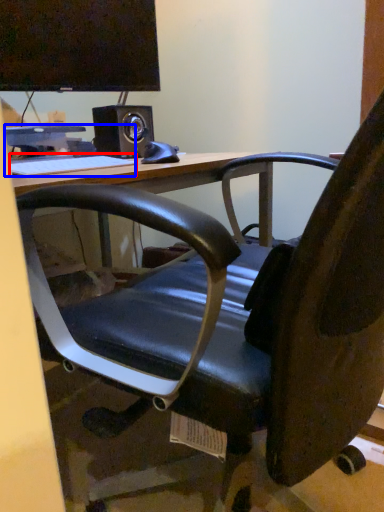
Question: Which point is further to the camera, keyboard (highlighted by a red box) or computer (highlighted by a blue box)?

Choices:
 (A) keyboard
 (B) computer

Answer: (B)